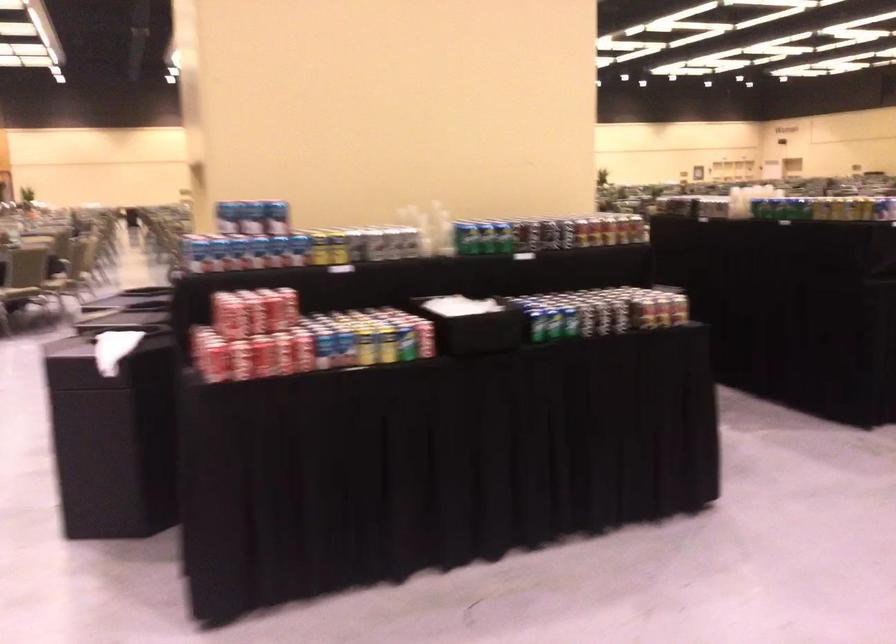
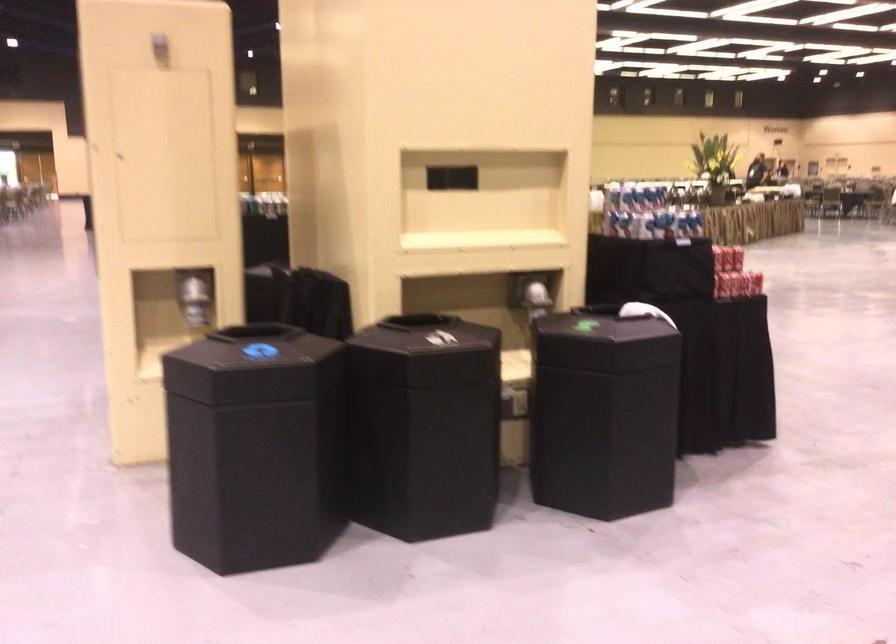
Question: I am providing you with two images of the same scene from different viewpoints. Which of the following objects are not visible in image2?

Choices:
 (A) shiny dispenser lever
 (B) green soda can
 (C) black bin lid
 (D) metal valve lever

Answer: (B)